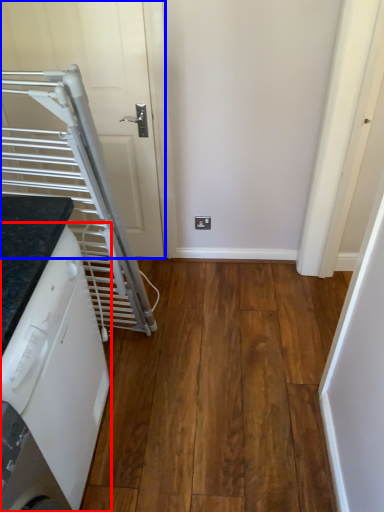
Question: Which of the following is the farthest to the observer, home appliance (highlighted by a red box) or door (highlighted by a blue box)?

Choices:
 (A) home appliance
 (B) door

Answer: (B)